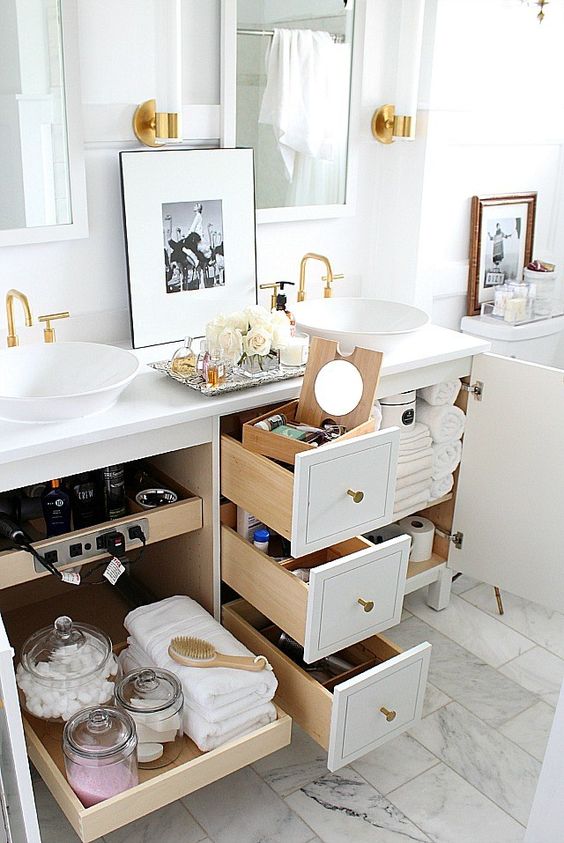
Where is `open drawer`? The width and height of the screenshot is (564, 843). open drawer is located at coordinates (311, 701), (246, 745), (274, 592), (277, 481).